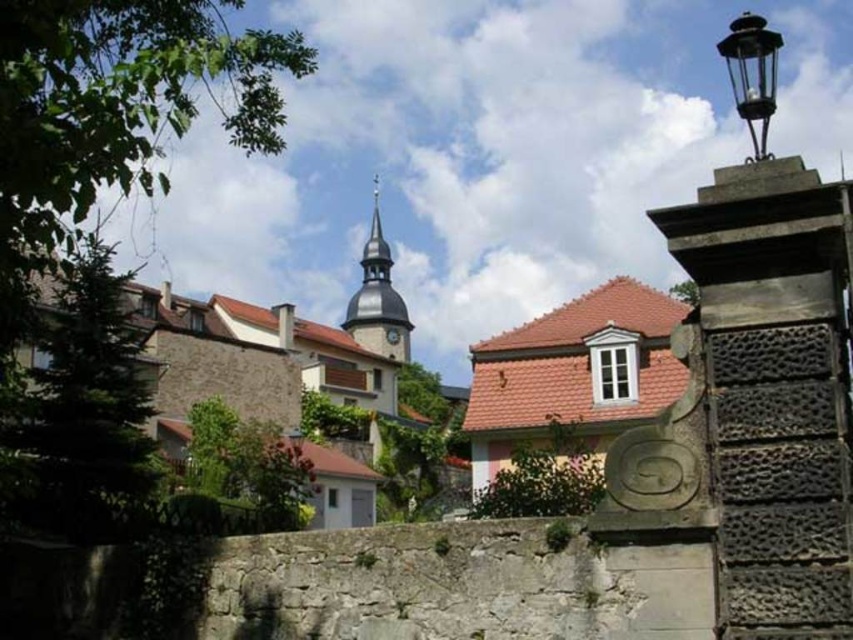
Question: Which object appears farthest from the camera in this image?

Choices:
 (A) black metal/iron streetlamp at upper right
 (B) smooth gray steeple at center

Answer: (B)

Question: Which object is positioned closest to the smooth gray steeple at center?

Choices:
 (A) metallic gray clock at center
 (B) black metal/iron streetlamp at upper right

Answer: (A)

Question: Among these objects, which one is farthest from the camera?

Choices:
 (A) metallic gray clock at center
 (B) smooth gray steeple at center

Answer: (A)

Question: Does smooth gray steeple at center appear over black metal/iron streetlamp at upper right?

Choices:
 (A) no
 (B) yes

Answer: (A)

Question: Observing the image, what is the correct spatial positioning of black metal/iron streetlamp at upper right in reference to metallic gray clock at center?

Choices:
 (A) below
 (B) above

Answer: (B)

Question: Is black metal/iron streetlamp at upper right above metallic gray clock at center?

Choices:
 (A) no
 (B) yes

Answer: (B)